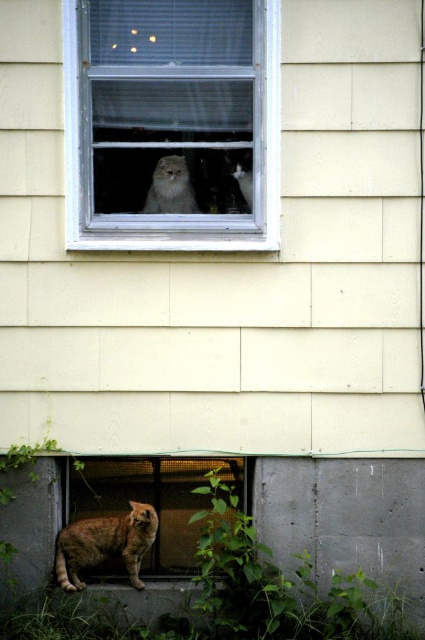
You are a cat sitting at point [164,208] and want to jump to the window with the fluffy cat. To do so, you must jump over an obstacle located at point [231,248]. Can you safely jump over the obstacle to reach the window?

Point [231,248] is in front of point [164,208], so the obstacle is between you and the window. You cannot safely jump over it to reach the window.

You are a cat lover who wants to take a photo of the white plastic window at upper center and the fuzzy gray cat at upper center. Since you want the window to appear bigger in the photo than the cat, which object should you focus on to ensure the window looks larger?

The white plastic window at upper center is already larger in size than the fuzzy gray cat at upper center, so focusing on the window will ensure it appears bigger in the photo.

You are a cat owner who wants to ensure both cats can see each other through the window. Based on their positions, can the fuzzy gray cat at upper center see the fluffy white cat at upper center through the window?

The fuzzy gray cat at upper center is below the fluffy white cat at upper center, so they can see each other through the window as their positions are vertically aligned.